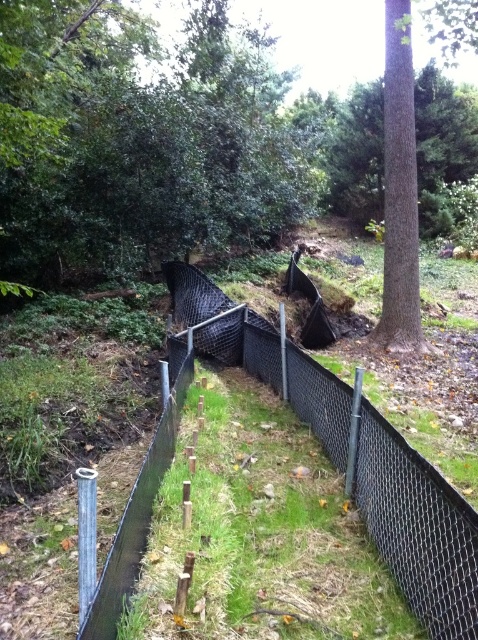
Does point (194, 323) lie in front of point (399, 51)?

No, (194, 323) is further to viewer.

What are the coordinates of `black mesh fence at center` in the screenshot? It's located at (416, 528).

Can you confirm if brown textured tree at center is positioned above black mesh fence at center?

Yes.

Is brown textured tree at center to the left of black mesh fence at center from the viewer's perspective?

Incorrect, brown textured tree at center is not on the left side of black mesh fence at center.

What are the coordinates of `brown textured tree at center` in the screenshot? It's located at (142, 141).

Between brown textured tree at center and brown textured tree at upper right, which one appears on the right side from the viewer's perspective?

brown textured tree at upper right

From the picture: Does brown textured tree at center appear on the right side of brown textured tree at upper right?

In fact, brown textured tree at center is to the left of brown textured tree at upper right.

Does point (251, 212) come in front of point (412, 186)?

No, it is behind (412, 186).

The width and height of the screenshot is (478, 640). What are the coordinates of `brown textured tree at center` in the screenshot? It's located at (142, 141).